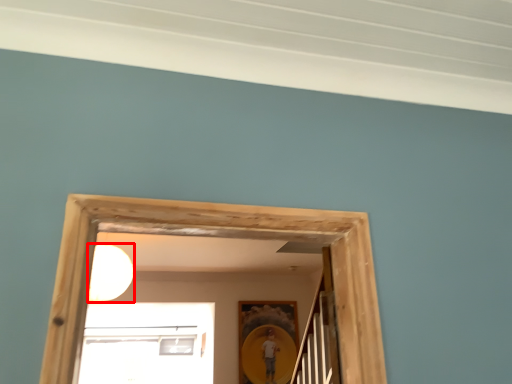
Question: From the image's perspective, what is the correct spatial relationship of light (annotated by the red box) in relation to picture frame?

Choices:
 (A) above
 (B) below

Answer: (A)